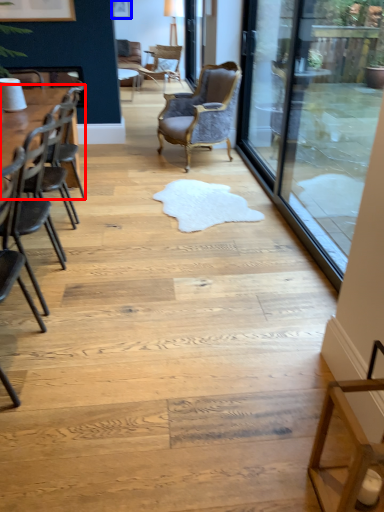
Question: Which object appears farthest to the camera in this image, table (highlighted by a red box) or picture frame (highlighted by a blue box)?

Choices:
 (A) table
 (B) picture frame

Answer: (B)